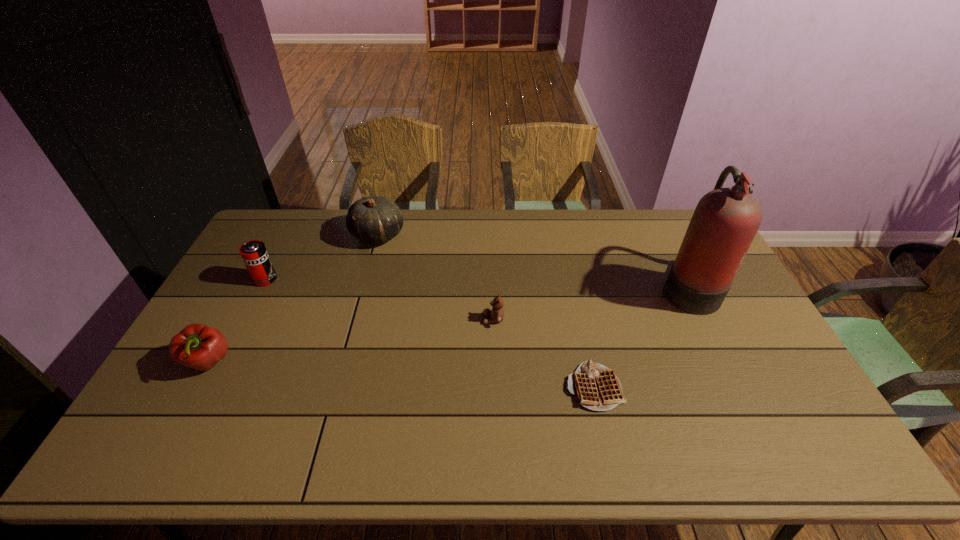
I want to click on free space between the bell pepper and the second shortest object, so click(351, 341).

Where is `vacant area that lies between the teddy bear and the third object from left to right`? The width and height of the screenshot is (960, 540). vacant area that lies between the teddy bear and the third object from left to right is located at coordinates (436, 277).

Locate an element on the screen. vacant area that lies between the can and the bell pepper is located at coordinates (237, 321).

You are a GUI agent. You are given a task and a screenshot of the screen. Output one action in this format:
    pyautogui.click(x=<x>, y=<y>)
    Task: Click on the unoccupied area between the waffle and the can
    This screenshot has width=960, height=540.
    Given the screenshot: What is the action you would take?
    pyautogui.click(x=430, y=333)

At what (x,y) coordinates should I click in order to perform the action: click on free spot between the waffle and the can. Please return your answer as a coordinate pair (x, y). This screenshot has height=540, width=960. Looking at the image, I should click on (430, 333).

Where is `free space between the fifth object from left to right and the fire extinguisher`? free space between the fifth object from left to right and the fire extinguisher is located at coordinates (641, 337).

Where is `free space between the bell pepper and the can`? The image size is (960, 540). free space between the bell pepper and the can is located at coordinates (237, 321).

Find the location of `vacant space in between the third object from left to right and the can`. vacant space in between the third object from left to right and the can is located at coordinates (x=322, y=257).

Locate an element on the screen. free point between the fire extinguisher and the second object from right to left is located at coordinates (641, 337).

The width and height of the screenshot is (960, 540). I want to click on free spot between the fourth object from left to right and the bell pepper, so click(351, 341).